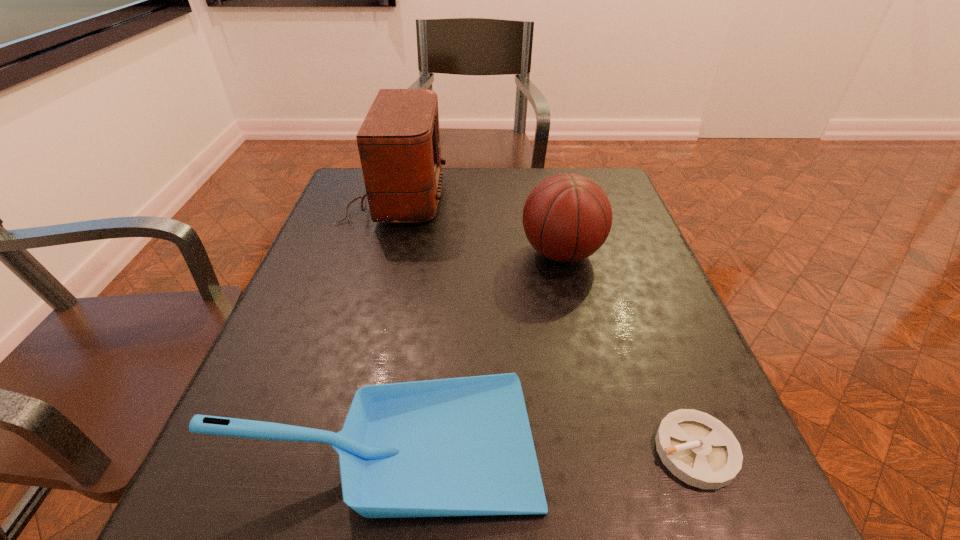
You are a GUI agent. You are given a task and a screenshot of the screen. Output one action in this format:
    pyautogui.click(x=<x>, y=<y>)
    Task: Click on the free point that satisfies the following two spatial constraints: 1. on the front panel of the radio receiver; 2. on the right side of the second tallest object
    
    Given the screenshot: What is the action you would take?
    pyautogui.click(x=380, y=253)

This screenshot has height=540, width=960. Find the location of `free space that satisfies the following two spatial constraints: 1. on the back side of the third tallest object; 2. on the front panel of the farthest object`. free space that satisfies the following two spatial constraints: 1. on the back side of the third tallest object; 2. on the front panel of the farthest object is located at coordinates (430, 197).

At what (x,y) coordinates should I click in order to perform the action: click on vacant position in the image that satisfies the following two spatial constraints: 1. on the back side of the third shortest object; 2. on the right side of the dustpan. Please return your answer as a coordinate pair (x, y). This screenshot has height=540, width=960. Looking at the image, I should click on (420, 253).

You are a GUI agent. You are given a task and a screenshot of the screen. Output one action in this format:
    pyautogui.click(x=<x>, y=<y>)
    Task: Click on the vacant space that satisfies the following two spatial constraints: 1. on the front panel of the radio receiver; 2. on the right side of the dustpan
    The height and width of the screenshot is (540, 960).
    Given the screenshot: What is the action you would take?
    pyautogui.click(x=328, y=441)

Find the location of a particular element. Image resolution: width=960 pixels, height=540 pixels. free space that satisfies the following two spatial constraints: 1. on the front panel of the radio receiver; 2. on the left side of the second farthest object is located at coordinates (x=380, y=253).